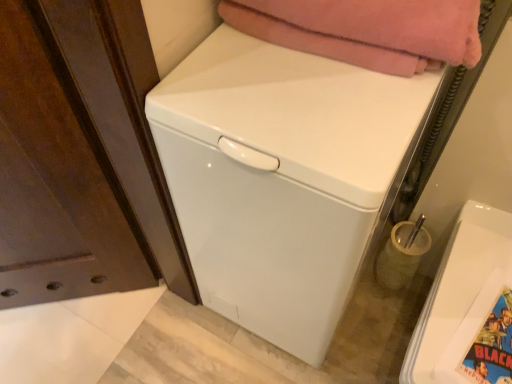
Locate an element on the screen. vacant area in front of soft pink blanket at upper center is located at coordinates (324, 118).